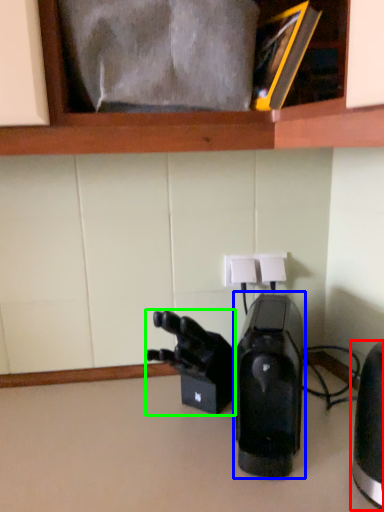
Question: Considering the real-world distances, which object is farthest from home appliance (highlighted by a red box)? home appliance (highlighted by a blue box) or video camera (highlighted by a green box)?

Choices:
 (A) home appliance
 (B) video camera

Answer: (B)